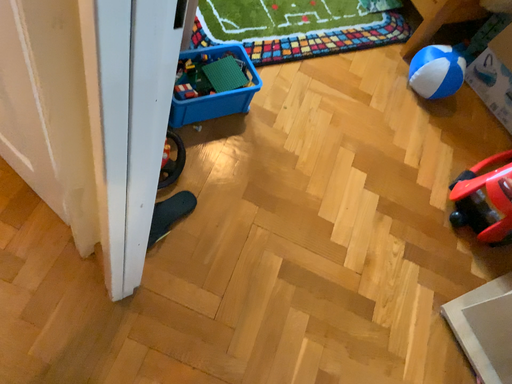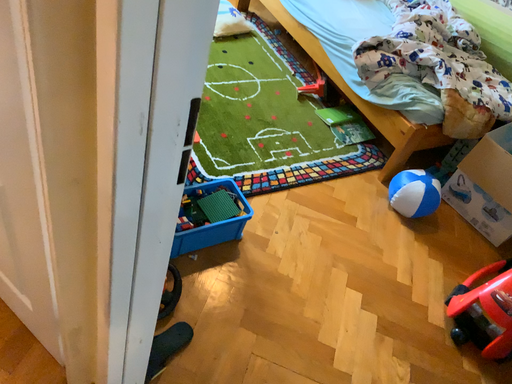
Question: Which way did the camera rotate in the video?

Choices:
 (A) rotated downward
 (B) rotated upward

Answer: (B)